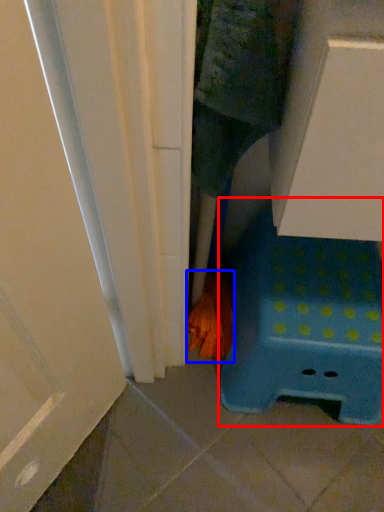
Question: Which object is closer to the camera taking this photo, furniture (highlighted by a red box) or hand (highlighted by a blue box)?

Choices:
 (A) furniture
 (B) hand

Answer: (A)